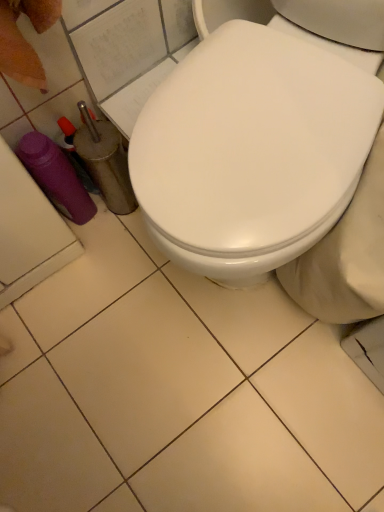
Question: Is white glossy toilet at center not within purple plastic bottle at lower left?

Choices:
 (A) yes
 (B) no

Answer: (A)

Question: Considering the relative sizes of white glossy toilet at center and purple plastic bottle at lower left in the image provided, is white glossy toilet at center wider than purple plastic bottle at lower left?

Choices:
 (A) yes
 (B) no

Answer: (A)

Question: Can you confirm if white glossy toilet at center is smaller than purple plastic bottle at lower left?

Choices:
 (A) no
 (B) yes

Answer: (A)

Question: Considering the relative positions of white glossy toilet at center and purple plastic bottle at lower left in the image provided, is white glossy toilet at center to the right of purple plastic bottle at lower left from the viewer's perspective?

Choices:
 (A) yes
 (B) no

Answer: (A)

Question: Is the depth of white glossy toilet at center less than that of purple plastic bottle at lower left?

Choices:
 (A) yes
 (B) no

Answer: (A)

Question: From the image's perspective, relative to white glossy toilet at center, is purple plastic bottle at lower left above or below?

Choices:
 (A) below
 (B) above

Answer: (A)

Question: Considering their positions, is purple plastic bottle at lower left located in front of or behind white glossy toilet at center?

Choices:
 (A) behind
 (B) front

Answer: (A)

Question: Is purple plastic bottle at lower left bigger or smaller than white glossy toilet at center?

Choices:
 (A) big
 (B) small

Answer: (B)

Question: Is purple plastic bottle at lower left spatially inside white glossy toilet at center, or outside of it?

Choices:
 (A) inside
 (B) outside

Answer: (B)

Question: From the image's perspective, is purple plastic bottle at lower left above or below white glossy toilet seat at center?

Choices:
 (A) below
 (B) above

Answer: (B)

Question: Considering the relative positions of purple plastic bottle at lower left and white glossy toilet seat at center in the image provided, is purple plastic bottle at lower left to the left or to the right of white glossy toilet seat at center?

Choices:
 (A) left
 (B) right

Answer: (A)

Question: From a real-world perspective, is purple plastic bottle at lower left physically located above or below white glossy toilet seat at center?

Choices:
 (A) below
 (B) above

Answer: (A)

Question: Do you think purple plastic bottle at lower left is within white glossy toilet seat at center, or outside of it?

Choices:
 (A) outside
 (B) inside

Answer: (A)

Question: Considering their positions, is white glossy toilet at center located in front of or behind purple plastic bottle at lower left?

Choices:
 (A) behind
 (B) front

Answer: (B)

Question: Do you think white glossy toilet at center is within purple plastic bottle at lower left, or outside of it?

Choices:
 (A) inside
 (B) outside

Answer: (B)